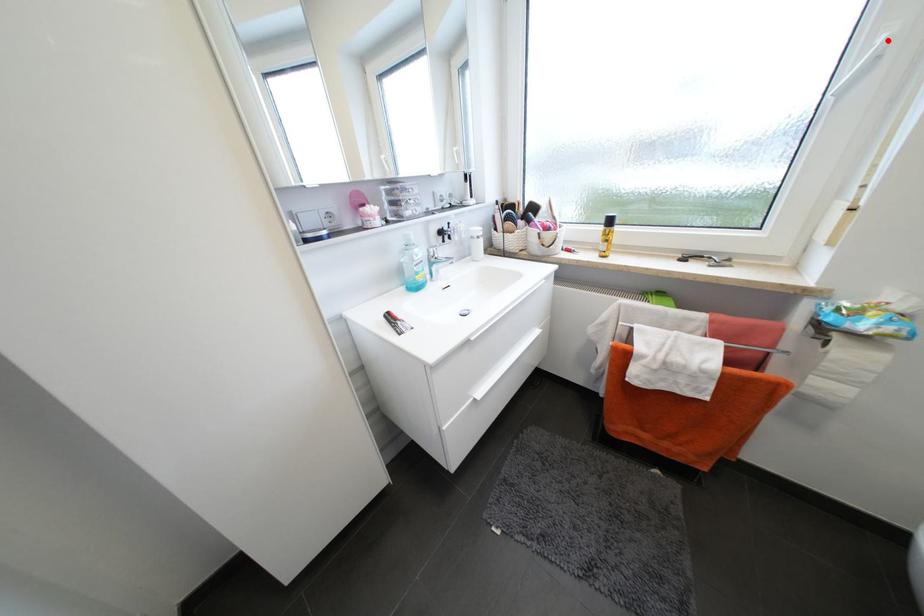
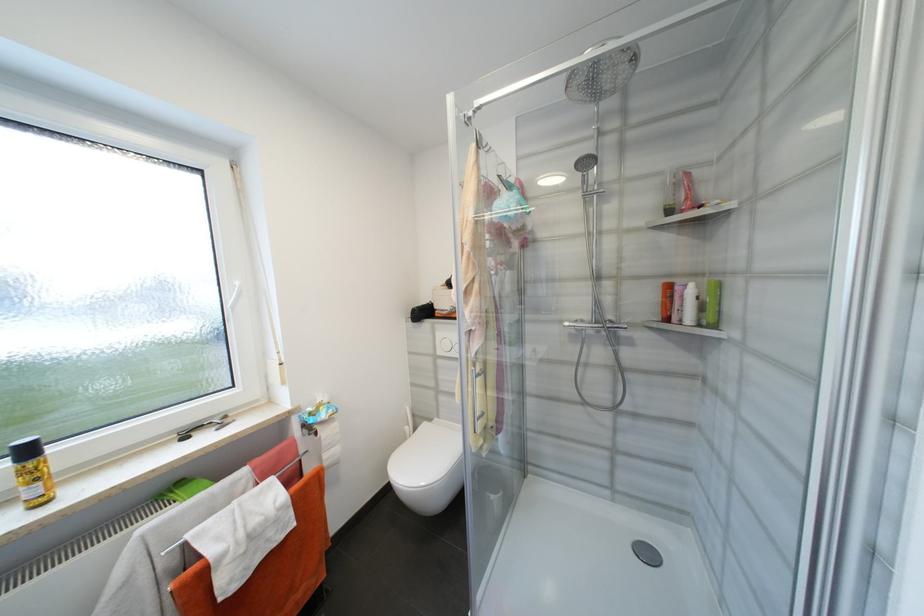
Question: A red point is marked in image1. In image2, is the corresponding 3D point closer to the camera or farther? Reply with the corresponding letter.

Choices:
 (A) The corresponding 3D point is closer.
 (B) The corresponding 3D point is farther.

Answer: (A)